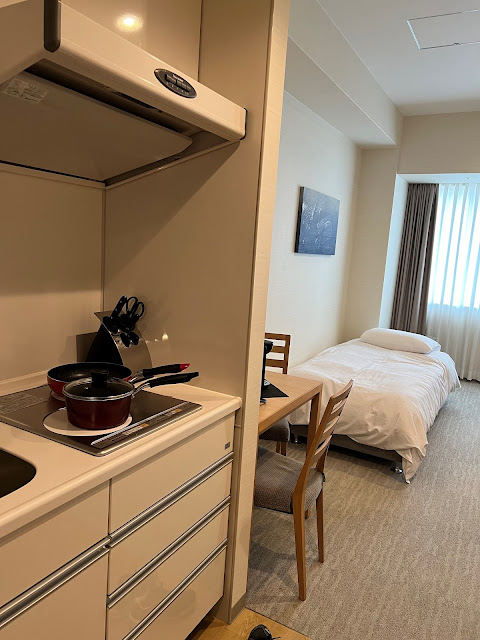
Point out all instances of where you'd sleep in the image. Your answer should be formatted as a list of tuples, i.e. [(x1, y1), (x2, y2), ...], where each tuple contains the x and y coordinates of a point satisfying the conditions above.

[(382, 376)]